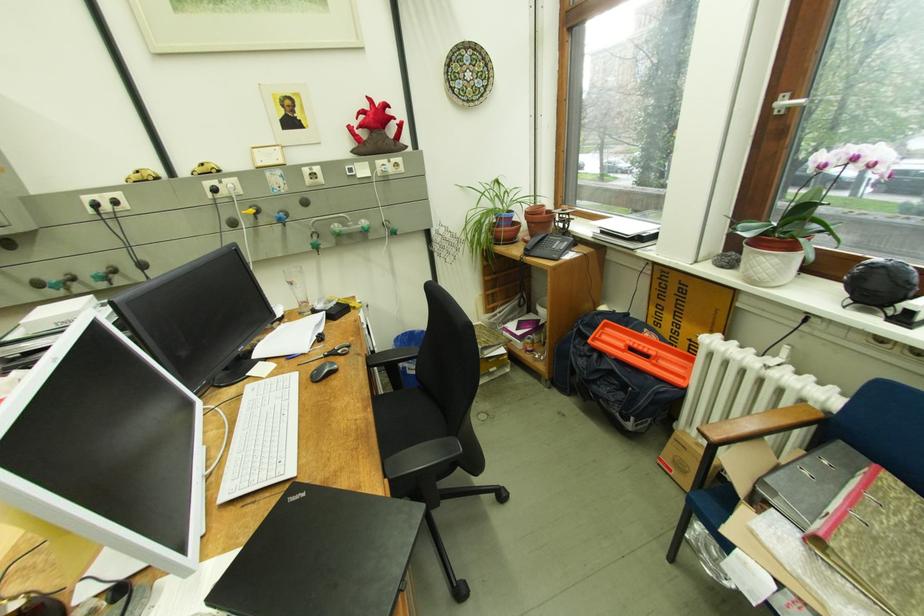
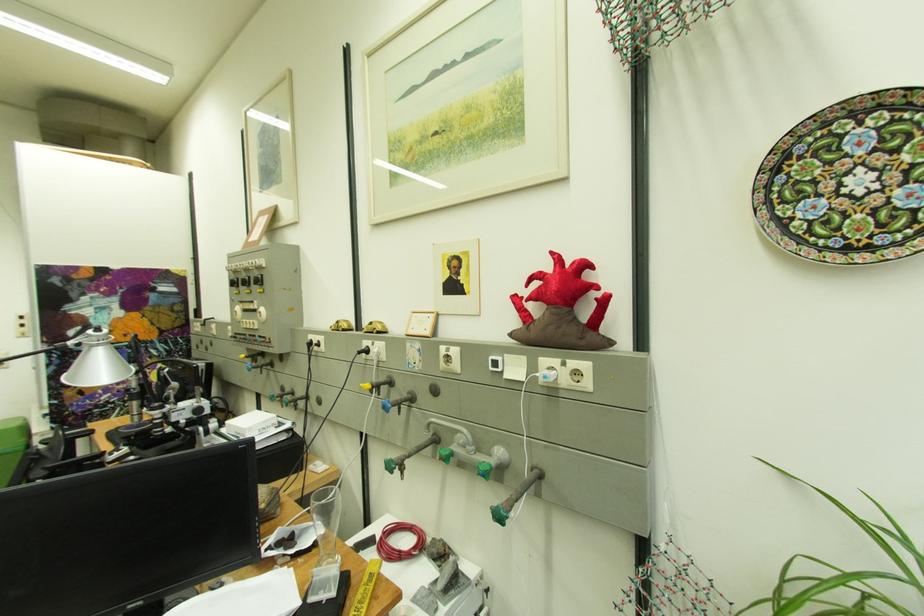
Locate, in the second image, the point that corresponds to point 219,185 in the first image.

(375, 344)